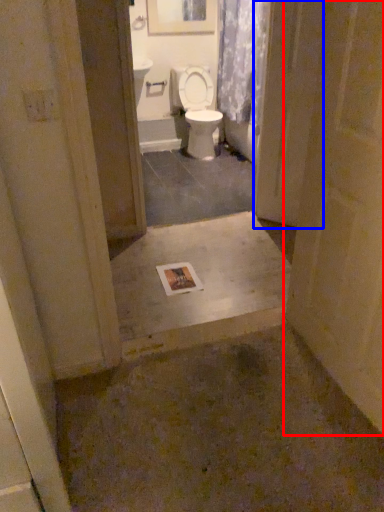
Question: Which of the following is the farthest to the observer, door (highlighted by a red box) or screen door (highlighted by a blue box)?

Choices:
 (A) door
 (B) screen door

Answer: (B)